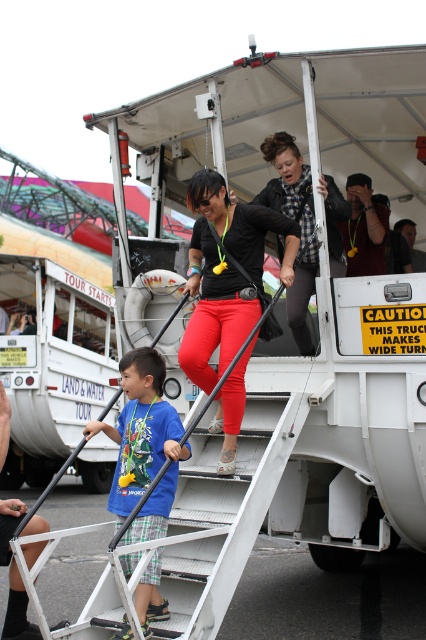
Is matte black shirt at center shorter than blue cotton shirt at center?

In fact, matte black shirt at center may be taller than blue cotton shirt at center.

Is point (207, 172) less distant than point (109, 497)?

No.

Locate an element on the screen. The width and height of the screenshot is (426, 640). matte black shirt at center is located at coordinates (226, 273).

Can you confirm if matte black shirt at center is taller than plaid fabric shirt at upper center?

Yes, matte black shirt at center is taller than plaid fabric shirt at upper center.

Is matte black shirt at center above plaid fabric shirt at upper center?

No, matte black shirt at center is not above plaid fabric shirt at upper center.

Identify the location of matte black shirt at center. (226, 273).

Who is higher up, metallic gray stairs at center or matte black shirt at center?

matte black shirt at center is higher up.

Which of these two, metallic gray stairs at center or matte black shirt at center, stands taller?

matte black shirt at center

Between point (250, 515) and point (210, 275), which one is positioned in front?

Point (250, 515)

This screenshot has width=426, height=640. I want to click on metallic gray stairs at center, so click(x=222, y=515).